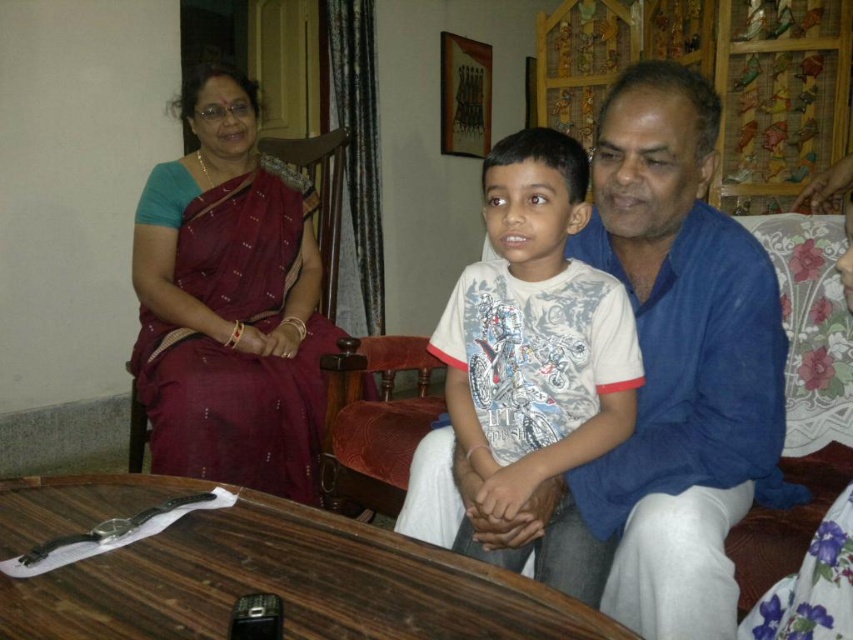
Does blue cotton shirt at center have a lesser width compared to wooden table at lower center?

Yes, blue cotton shirt at center is thinner than wooden table at lower center.

Who is more forward, (697, 522) or (33, 490)?

Point (697, 522)

Based on the photo, who is more forward, (728,589) or (372,557)?

Point (372,557)

Identify the location of blue cotton shirt at center. Image resolution: width=853 pixels, height=640 pixels. (659, 376).

Image resolution: width=853 pixels, height=640 pixels. What do you see at coordinates (287, 586) in the screenshot?
I see `wooden table at lower center` at bounding box center [287, 586].

Looking at this image, is wooden table at lower center below white cotton shirt at center?

Indeed, wooden table at lower center is positioned under white cotton shirt at center.

Between point (109, 573) and point (596, 426), which one is positioned in front?

Positioned in front is point (109, 573).

Where is `wooden table at lower center`? wooden table at lower center is located at coordinates (287, 586).

Between blue cotton shirt at center and maroon silk saree at upper left, which one has less height?

blue cotton shirt at center

Find the location of a particular element. Image resolution: width=853 pixels, height=640 pixels. blue cotton shirt at center is located at coordinates (659, 376).